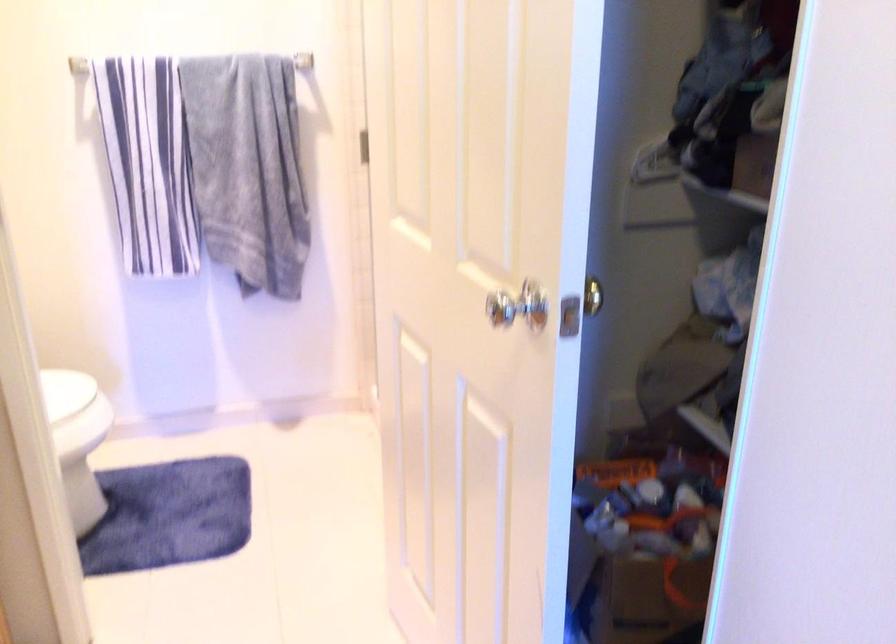
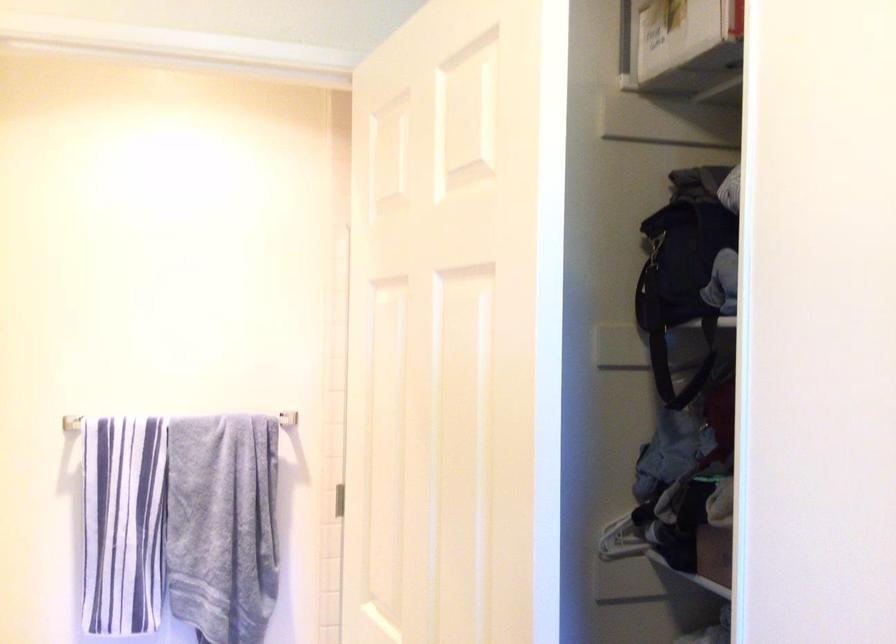
Question: How did the camera likely rotate?

Choices:
 (A) Left
 (B) Right
 (C) Up
 (D) Down

Answer: (C)